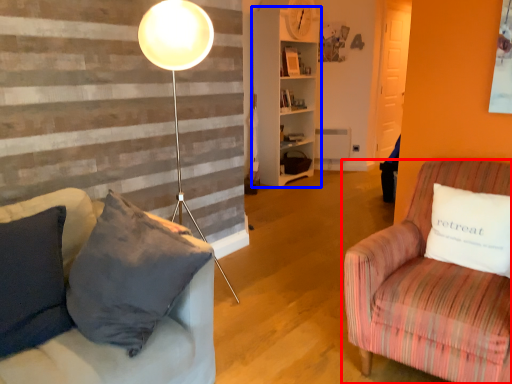
Question: Which point is closer to the camera, studio couch (highlighted by a red box) or shelf (highlighted by a blue box)?

Choices:
 (A) studio couch
 (B) shelf

Answer: (A)